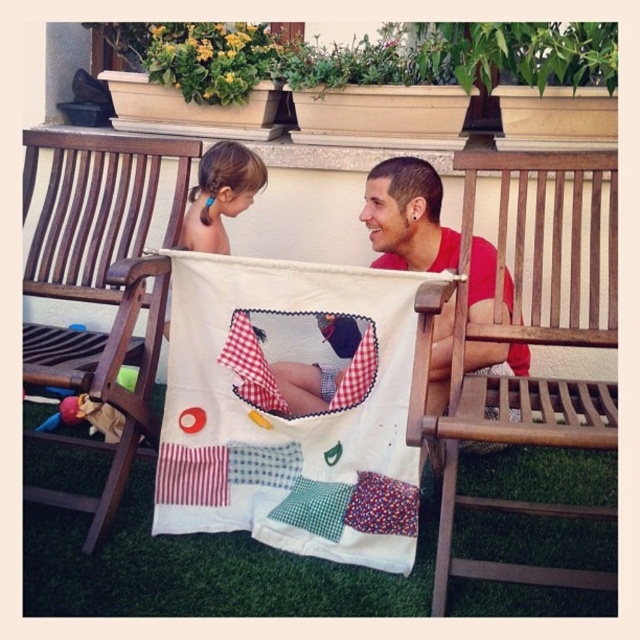
Question: Which object appears farthest from the camera in this image?

Choices:
 (A) patchwork fabric quilt at center
 (B) wooden park bench at left
 (C) red cotton shirt at center

Answer: (C)

Question: Estimate the real-world distances between objects in this image. Which object is closer to the red cotton shirt at center?

Choices:
 (A) wooden park bench at left
 (B) patchwork fabric quilt at center
 (C) wooden at right

Answer: (C)

Question: From the image, what is the correct spatial relationship of patchwork fabric quilt at center in relation to blonde hair at center?

Choices:
 (A) above
 (B) below

Answer: (B)

Question: Observing the image, what is the correct spatial positioning of wooden at right in reference to blonde hair at center?

Choices:
 (A) left
 (B) right

Answer: (B)

Question: Which point is closer to the camera taking this photo?

Choices:
 (A) (49, 326)
 (B) (252, 444)
 (C) (237, 156)
 (D) (228, 211)

Answer: (B)

Question: Can you confirm if red cotton shirt at center is positioned below blonde hair at center?

Choices:
 (A) yes
 (B) no

Answer: (A)